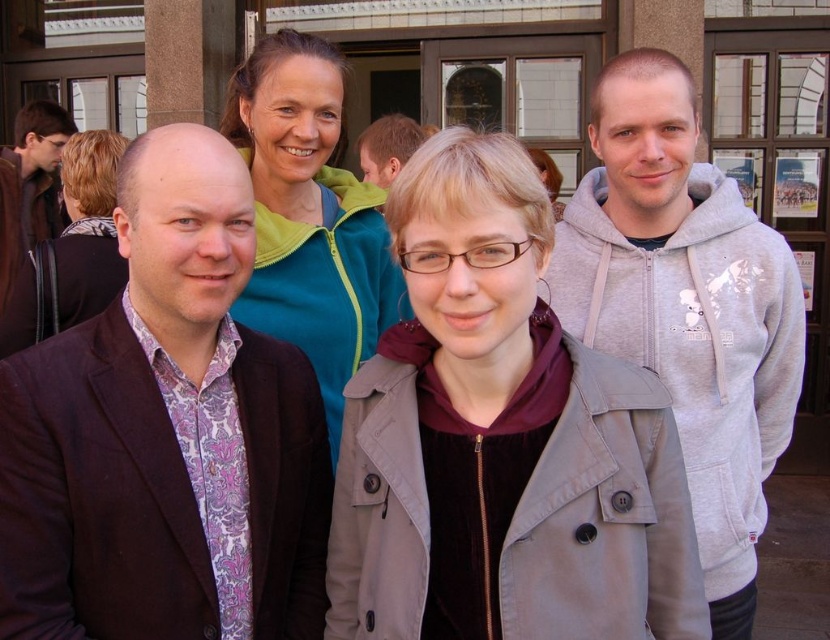
You are a photographer adjusting your camera settings. You notice the light gray fabric coat at center and the matte black jacket at left in your frame. Which of these items is positioned nearer to the camera?

The light gray fabric coat at center is closer to the viewer than the matte black jacket at left, so it is nearer to the camera.